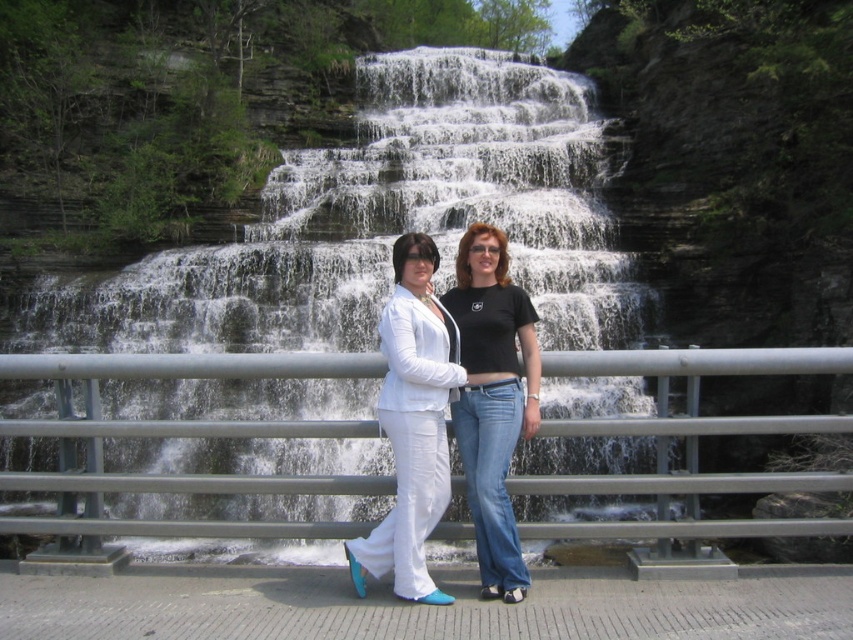
You are a photographer trying to capture a photo of the white textured water at center and the matte white pants at center. Which object appears taller in the frame?

The white textured water at center appears taller than the matte white pants at center in the frame.

You are a photographer planning to capture the waterfall scene. You notice the white textured water at center and the metallic gray railing at center. Which object would appear closer to the camera in the photo?

The white textured water at center is taller than the metallic gray railing at center, so it would appear closer to the camera in the photo.